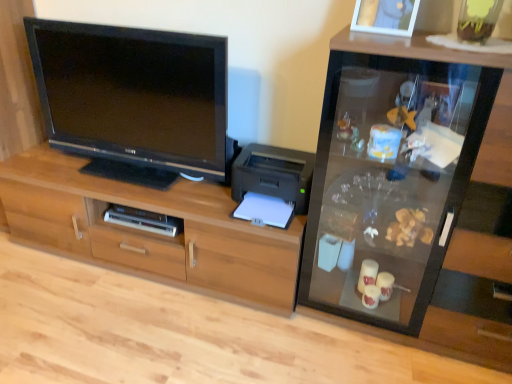
Where is `transparent glass cabinet at right`? The image size is (512, 384). transparent glass cabinet at right is located at coordinates (392, 170).

What do you see at coordinates (385, 16) in the screenshot? This screenshot has height=384, width=512. I see `wooden picture frame at upper right` at bounding box center [385, 16].

Identify the location of black plastic printer at center. The height and width of the screenshot is (384, 512). (274, 174).

What do you see at coordinates (143, 220) in the screenshot? This screenshot has height=384, width=512. I see `silver metallic dvd player at lower center` at bounding box center [143, 220].

Measure the distance between silver metallic dvd player at lower center and camera.

silver metallic dvd player at lower center is 6.16 feet from camera.

This screenshot has width=512, height=384. I want to click on transparent glass cabinet at right, so point(392,170).

Considering their positions, is transparent glass cabinet at right located in front of or behind black glossy tv at left?

Visually, transparent glass cabinet at right is located in front of black glossy tv at left.

From the image's perspective, is transparent glass cabinet at right under black glossy tv at left?

Yes.

Measure the distance from transparent glass cabinet at right to black glossy tv at left.

30.66 inches.

Considering the sizes of transparent glass cabinet at right and black glossy tv at left in the image, is transparent glass cabinet at right taller or shorter than black glossy tv at left?

transparent glass cabinet at right is taller than black glossy tv at left.

How distant is black plastic printer at center from transparent glass cabinet at right?

black plastic printer at center and transparent glass cabinet at right are 14.48 inches apart.

Between black plastic printer at center and transparent glass cabinet at right, which one is positioned in front?

transparent glass cabinet at right is more forward.

Looking at this image, could you tell me if black plastic printer at center is facing transparent glass cabinet at right?

No, black plastic printer at center is not turned towards transparent glass cabinet at right.

Can you confirm if black plastic printer at center is positioned to the right of transparent glass cabinet at right?

No.

Can you confirm if black plastic printer at center is positioned to the right of black glossy tv at left?

Yes, black plastic printer at center is to the right of black glossy tv at left.

Consider the image. Are black plastic printer at center and black glossy tv at left located far from each other?

No, black plastic printer at center is not far away from black glossy tv at left.

Between black plastic printer at center and black glossy tv at left, which one has more height?

Standing taller between the two is black glossy tv at left.

Which is closer to the camera, (246, 156) or (169, 36)?

Clearly, point (246, 156) is more distant from the camera than point (169, 36).

From the image's perspective, is wooden picture frame at upper right on top of black glossy tv at left?

Indeed, from the image's perspective, wooden picture frame at upper right is shown above black glossy tv at left.

Considering the relative positions of wooden picture frame at upper right and black glossy tv at left in the image provided, is wooden picture frame at upper right to the left or to the right of black glossy tv at left?

In the image, wooden picture frame at upper right appears on the right side of black glossy tv at left.

Find the location of a particular element. picture frame above the black glossy tv at left (from the image's perspective) is located at coordinates (385, 16).

Is wooden picture frame at upper right placed right next to black glossy tv at left?

No, wooden picture frame at upper right is not touching black glossy tv at left.

Does black glossy tv at left lie behind transparent glass cabinet at right?

Yes, it is.

What's the angular difference between black glossy tv at left and transparent glass cabinet at right's facing directions?

There is a 0.0898-degree angle between the facing directions of black glossy tv at left and transparent glass cabinet at right.

In the scene shown: Does black glossy tv at left have a lesser width compared to transparent glass cabinet at right?

Correct, the width of black glossy tv at left is less than that of transparent glass cabinet at right.

Is point (216, 117) positioned in front of point (488, 80)?

No, (216, 117) is behind (488, 80).

Is black glossy tv at left bigger or smaller than wooden picture frame at upper right?

Clearly, black glossy tv at left is larger in size than wooden picture frame at upper right.

How distant is black glossy tv at left from wooden picture frame at upper right?

black glossy tv at left is 36.36 inches from wooden picture frame at upper right.

Is black glossy tv at left situated inside wooden picture frame at upper right or outside?

black glossy tv at left is not enclosed by wooden picture frame at upper right.

Considering the positions of objects black glossy tv at left and wooden picture frame at upper right in the image provided, who is more to the left, black glossy tv at left or wooden picture frame at upper right?

black glossy tv at left is more to the left.

Where is `cabinetry to the right of silver metallic dvd player at lower center`? This screenshot has width=512, height=384. cabinetry to the right of silver metallic dvd player at lower center is located at coordinates (150, 233).

From a real-world perspective, is silver metallic dvd player at lower center located beneath wooden cabinet at center?

No, from a real-world perspective, silver metallic dvd player at lower center is not below wooden cabinet at center.

Considering the points (149, 225) and (153, 240), which point is in front, point (149, 225) or point (153, 240)?

The point (153, 240) is closer to the camera.

This screenshot has height=384, width=512. Identify the location of television behind the transparent glass cabinet at right. (134, 95).

The height and width of the screenshot is (384, 512). In order to click on tv cabinet above the black plastic printer at center (from a real-world perspective) in this screenshot , I will do `click(392, 170)`.

From the image, which object appears to be farther from wooden picture frame at upper right, wooden cabinet at center or silver metallic dvd player at lower center?

The object further to wooden picture frame at upper right is silver metallic dvd player at lower center.

Based on their spatial positions, is wooden picture frame at upper right or silver metallic dvd player at lower center further from wooden cabinet at center?

wooden picture frame at upper right.

Which object lies nearer to the anchor point transparent glass cabinet at right, silver metallic dvd player at lower center or wooden cabinet at center?

Among the two, wooden cabinet at center is located nearer to transparent glass cabinet at right.

Based on their spatial positions, is black plastic printer at center or transparent glass cabinet at right closer to wooden cabinet at center?

black plastic printer at center.

Estimate the real-world distances between objects in this image. Which object is closer to wooden picture frame at upper right, black plastic printer at center or black glossy tv at left?

Based on the image, black plastic printer at center appears to be nearer to wooden picture frame at upper right.

Estimate the real-world distances between objects in this image. Which object is further from black glossy tv at left, wooden picture frame at upper right or wooden cabinet at center?

wooden picture frame at upper right is further to black glossy tv at left.

When comparing their distances from wooden cabinet at center, does silver metallic dvd player at lower center or black glossy tv at left seem closer?

Among the two, silver metallic dvd player at lower center is located nearer to wooden cabinet at center.

From the image, which object appears to be nearer to wooden cabinet at center, black glossy tv at left or black plastic printer at center?

black glossy tv at left is positioned closer to the anchor wooden cabinet at center.

Locate an element on the screen. The height and width of the screenshot is (384, 512). picture frame located between black glossy tv at left and transparent glass cabinet at right in the left-right direction is located at coordinates (385, 16).

Where is `printer between black glossy tv at left and wooden picture frame at upper right in the horizontal direction`? Image resolution: width=512 pixels, height=384 pixels. printer between black glossy tv at left and wooden picture frame at upper right in the horizontal direction is located at coordinates (274, 174).

The width and height of the screenshot is (512, 384). What are the coordinates of `printer between wooden cabinet at center and transparent glass cabinet at right from left to right` in the screenshot? It's located at (274, 174).

Find the location of `cabinetry situated between silver metallic dvd player at lower center and transparent glass cabinet at right from left to right`. cabinetry situated between silver metallic dvd player at lower center and transparent glass cabinet at right from left to right is located at coordinates (150, 233).